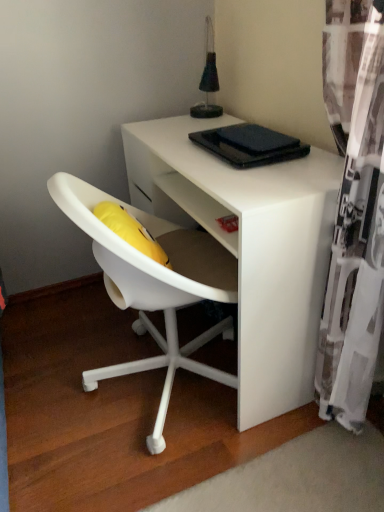
Question: Is white matte desk at center to the left or to the right of black matte pad at upper center in the image?

Choices:
 (A) left
 (B) right

Answer: (A)

Question: Considering the positions of point (284, 282) and point (236, 145), is point (284, 282) closer or farther from the camera than point (236, 145)?

Choices:
 (A) closer
 (B) farther

Answer: (A)

Question: Considering the real-world distances, which object is farthest from the white sheer curtain at right?

Choices:
 (A) black matte pad at upper center
 (B) white matte desk at center

Answer: (A)

Question: Which object is positioned farthest from the white sheer curtain at right?

Choices:
 (A) white matte desk at center
 (B) black matte pad at upper center

Answer: (B)